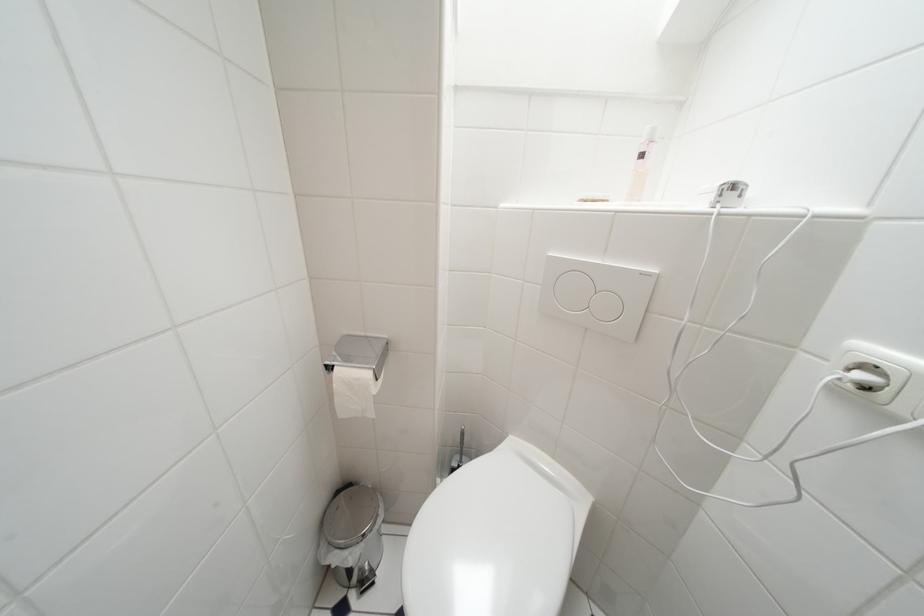
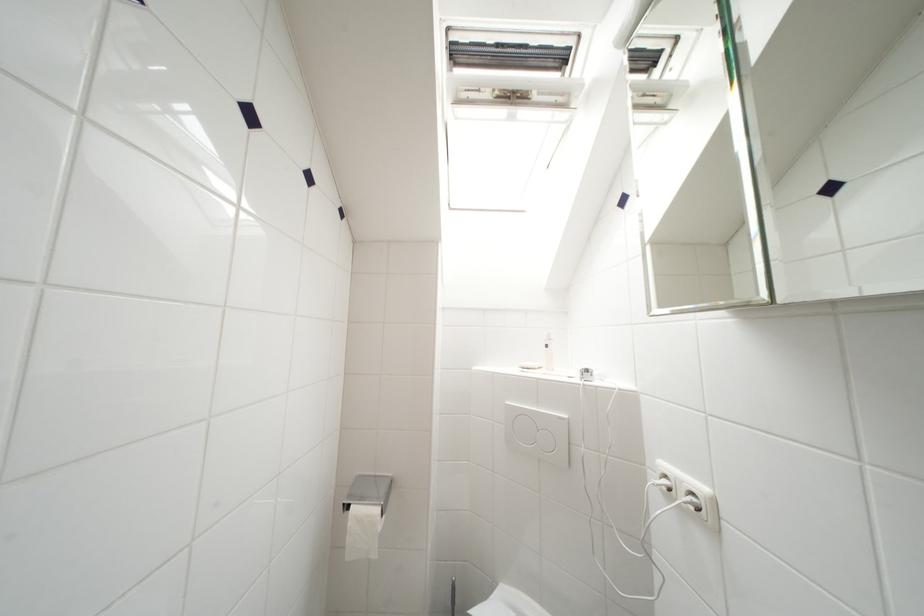
Where in the second image is the point corresponding to point 649,277 from the first image?

(565, 421)